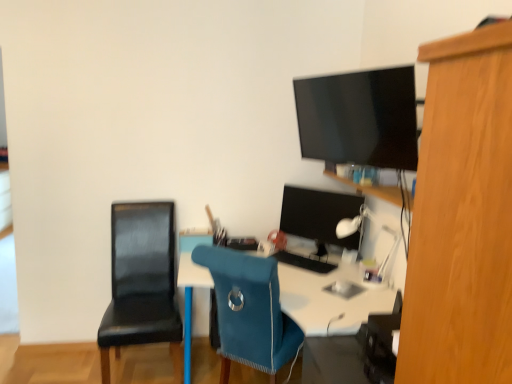
Where is `vacant region below white plastic lamp at upper right (from a real-world perspective)`? This screenshot has width=512, height=384. vacant region below white plastic lamp at upper right (from a real-world perspective) is located at coordinates (362, 282).